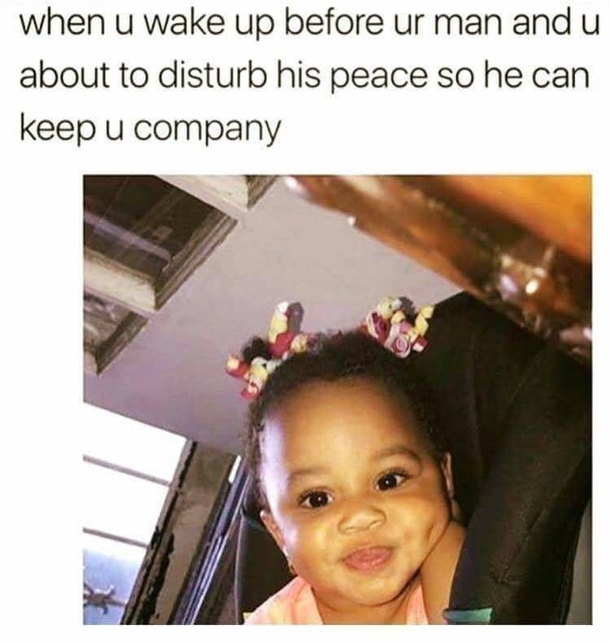
You are a GUI agent. You are given a task and a screenshot of the screen. Output one action in this format:
    pyautogui.click(x=<x>, y=<y>)
    Task: Click on the wall white
    This screenshot has height=642, width=610.
    Given the screenshot: What is the action you would take?
    pyautogui.click(x=188, y=336)